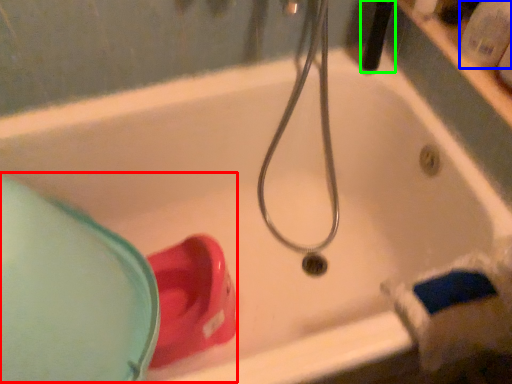
Question: Based on their relative distances, which object is farther from sink (highlighted by a red box)? Choose from toiletry (highlighted by a blue box) and shower (highlighted by a green box).

Choices:
 (A) toiletry
 (B) shower

Answer: (A)